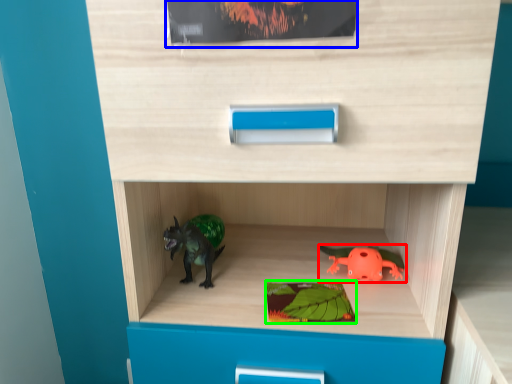
Question: Which object is positioned farthest from toy (highlighted by a red box)? Select from paperback book (highlighted by a blue box) and paperback book (highlighted by a green box).

Choices:
 (A) paperback book
 (B) paperback book

Answer: (A)